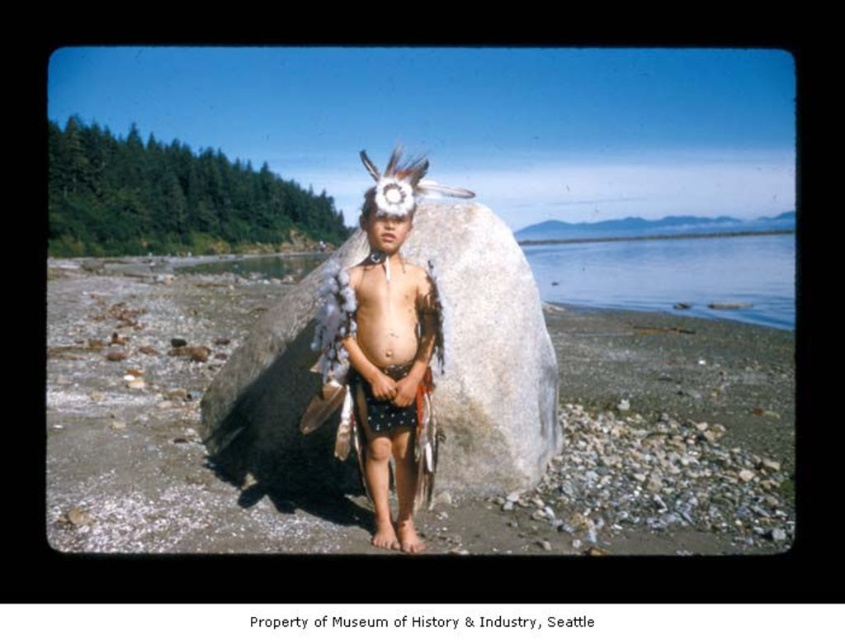
Question: Among these points, which one is nearest to the camera?

Choices:
 (A) (307, 483)
 (B) (691, 291)

Answer: (A)

Question: In this image, where is gray/rough rock at center located relative to clear water at center?

Choices:
 (A) left
 (B) right

Answer: (A)

Question: Which is farther from the clear water at center?

Choices:
 (A) gray/rough rock at center
 (B) smooth sand at center
 (C) white feather headdress at center

Answer: (C)

Question: Estimate the real-world distances between objects in this image. Which object is closer to the smooth sand at center?

Choices:
 (A) clear water at center
 (B) white feather headdress at center
 (C) gray/rough rock at center

Answer: (C)

Question: Where is smooth sand at center located in relation to gray/rough rock at center in the image?

Choices:
 (A) below
 (B) above

Answer: (B)

Question: Does gray/rough rock at center come in front of white feather headdress at center?

Choices:
 (A) yes
 (B) no

Answer: (B)